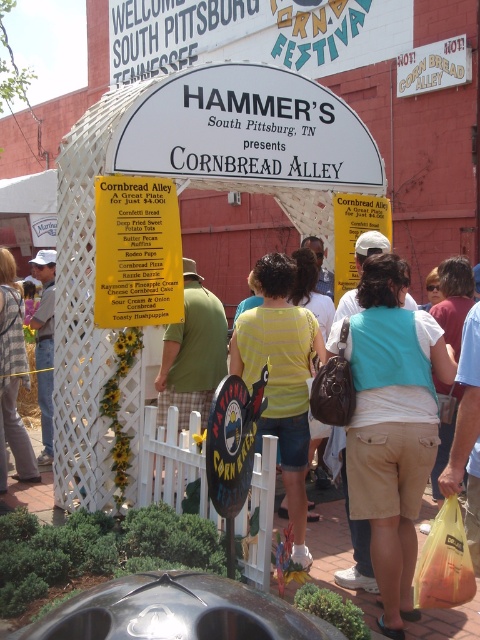
You are standing at the festival and want to take a photo of the Cornbread Alley sign. You notice two points marked as point coordinates in the image. Which point is closer to the camera? The points are labeled as point 1 at coordinates (155, 237) and point 2 at coordinates (20, 308).

Point 1 at coordinates (155, 237) is closer to the camera because it is in front of point 2 at coordinates (20, 308).

You are at the festival and want to read the yellow paper sign at center and the matte white hat at left. Which one do you need to look at more closely because it is smaller?

The matte white hat at left is smaller, so you need to look at it more closely.

You are at the festival and want to read the yellow paper sign at center and the matte white hat at left. Which object is taller?

The matte white hat at left is taller than the yellow paper sign at center.